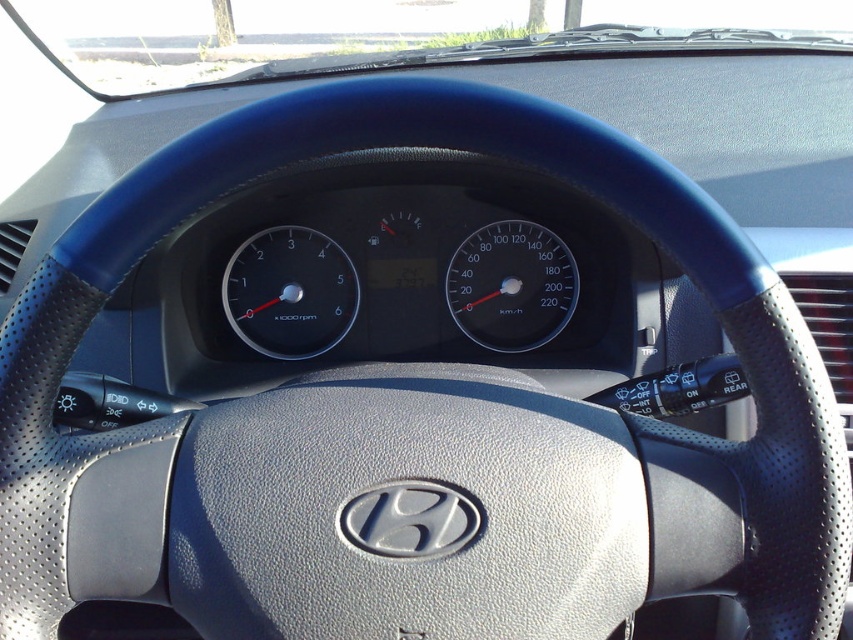
Is black leather speedometer at center taller than transparent glass speedometer at center?

Indeed, black leather speedometer at center has a greater height compared to transparent glass speedometer at center.

Who is shorter, black leather speedometer at center or transparent glass speedometer at center?

transparent glass speedometer at center is shorter.

This screenshot has width=853, height=640. What are the coordinates of `black leather speedometer at center` in the screenshot? It's located at (289, 292).

Identify the location of black leather speedometer at center. This screenshot has width=853, height=640. (289, 292).